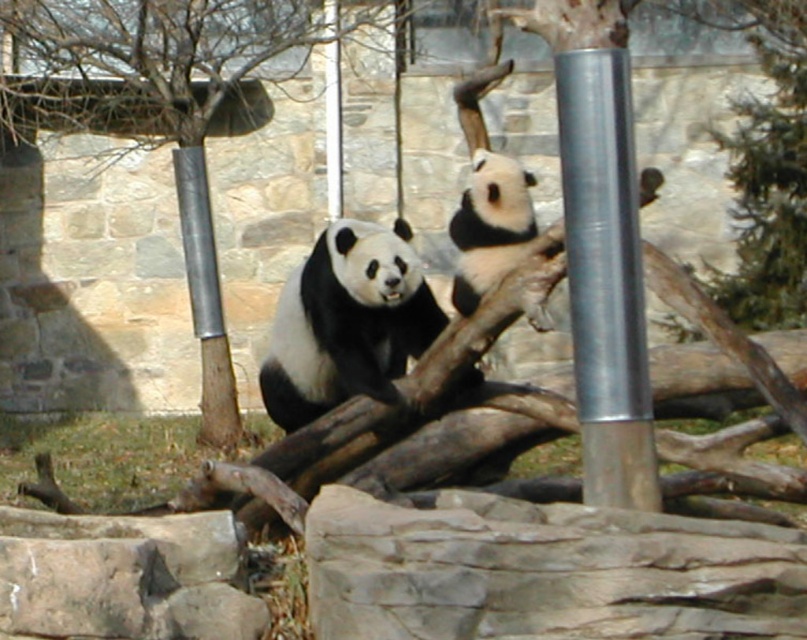
Question: Based on their relative distances, which object is nearer to the green textured tree at upper right?

Choices:
 (A) silver metallic pole at center right
 (B) silver metallic pole at center

Answer: (B)

Question: Is brushed metal tree at center bigger than black and white fur at upper center?

Choices:
 (A) yes
 (B) no

Answer: (A)

Question: Based on their relative distances, which object is nearer to the black and white fur at upper center?

Choices:
 (A) green textured tree at upper right
 (B) smooth bark tree at upper left

Answer: (A)

Question: Does silver metallic pole at center right have a greater width compared to black and white fur at upper center?

Choices:
 (A) no
 (B) yes

Answer: (B)

Question: Among these objects, which one is nearest to the camera?

Choices:
 (A) black and white fur at upper center
 (B) brushed metal tree at center

Answer: (A)

Question: Does black and white fur at center appear on the left side of black and white fur at upper center?

Choices:
 (A) yes
 (B) no

Answer: (A)